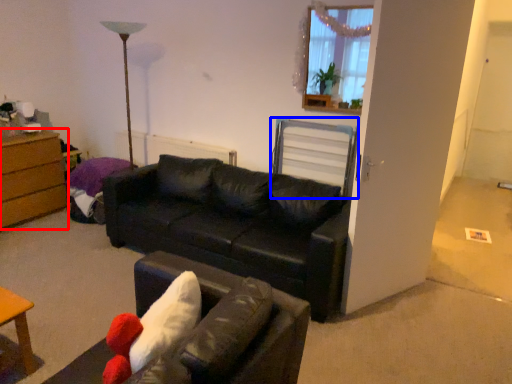
Question: Which point is further to the camera, chest of drawers (highlighted by a red box) or swivel chair (highlighted by a blue box)?

Choices:
 (A) chest of drawers
 (B) swivel chair

Answer: (A)